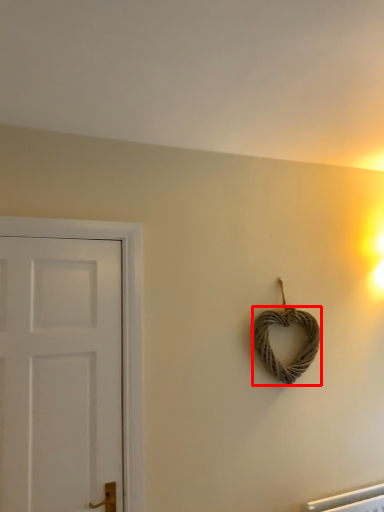
Question: From the image's perspective, where is rope (annotated by the red box) located in relation to door in the image?

Choices:
 (A) above
 (B) below

Answer: (A)